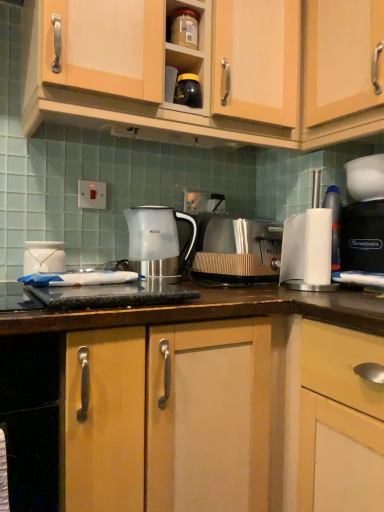
The image size is (384, 512). What do you see at coordinates (229, 318) in the screenshot? I see `brown laminate countertop at center` at bounding box center [229, 318].

Based on the photo, in order to face black plastic coffee machine at right, should I rotate leftwards or rightwards?

Turn right by 23.637 degrees to look at black plastic coffee machine at right.

Where is `wooden cabinet at upper center, which appears as the 1th cabinetry when viewed from the left`? The height and width of the screenshot is (512, 384). wooden cabinet at upper center, which appears as the 1th cabinetry when viewed from the left is located at coordinates (214, 71).

Where is `metallic silver toaster at center`? metallic silver toaster at center is located at coordinates (236, 249).

This screenshot has height=512, width=384. Identify the location of brown laminate countertop at center. (229, 318).

Does brown laminate countertop at center have a greater height compared to black glossy jar at upper center, which is the second appliance in bottom-to-top order?

Indeed, brown laminate countertop at center has a greater height compared to black glossy jar at upper center, which is the second appliance in bottom-to-top order.

From the image's perspective, is brown laminate countertop at center on black glossy jar at upper center, which is the second appliance in bottom-to-top order?

No.

Which is correct: brown laminate countertop at center is inside black glossy jar at upper center, the first appliance in the top-to-bottom sequence, or outside of it?

brown laminate countertop at center lies outside black glossy jar at upper center, the first appliance in the top-to-bottom sequence.

Is black plastic coffee machine at right facing away from white glossy jar at left, which is the first appliance in bottom-to-top order?

No, black plastic coffee machine at right's orientation is not away from white glossy jar at left, which is the first appliance in bottom-to-top order.

From the image's perspective, which one is positioned lower, black plastic coffee machine at right or white glossy jar at left, which is the first appliance in bottom-to-top order?

white glossy jar at left, which is the first appliance in bottom-to-top order.

Between point (361, 160) and point (31, 265), which one is positioned behind?

The point (361, 160) is farther.

Can you confirm if black plastic coffee machine at right is positioned to the right of white glossy jar at left, the 2th appliance positioned from the top?

Yes, black plastic coffee machine at right is to the right of white glossy jar at left, the 2th appliance positioned from the top.

Is metallic silver toaster at center far away from matte plastic container at upper center?

No, metallic silver toaster at center is not far from matte plastic container at upper center.

Is the position of metallic silver toaster at center more distant than that of matte plastic container at upper center?

Yes, metallic silver toaster at center is further from the viewer.

From a real-world perspective, is metallic silver toaster at center located higher than matte plastic container at upper center?

No, from a real-world perspective, metallic silver toaster at center is not on top of matte plastic container at upper center.

Is point (218, 224) less distant than point (190, 7)?

No.

Which is behind, brown laminate countertop at center or black plastic coffee machine at right?

black plastic coffee machine at right is further away from the camera.

Is brown laminate countertop at center aimed at black plastic coffee machine at right?

No, brown laminate countertop at center is not turned towards black plastic coffee machine at right.

Considering the sizes of brown laminate countertop at center and black plastic coffee machine at right in the image, is brown laminate countertop at center wider or thinner than black plastic coffee machine at right?

Clearly, brown laminate countertop at center has more width compared to black plastic coffee machine at right.

Between brown laminate countertop at center and black plastic coffee machine at right, which one has more height?

With more height is brown laminate countertop at center.

Is white paper towel at right at the back of white glossy jar at left, the 1th appliance positioned from the left?

No, white glossy jar at left, the 1th appliance positioned from the left, is not facing the opposite direction of white paper towel at right.

Can you see white glossy jar at left, the 2th appliance positioned from the top, touching white paper towel at right?

white glossy jar at left, the 2th appliance positioned from the top, and white paper towel at right are clearly separated.

Considering the sizes of objects white glossy jar at left, which is the first appliance in bottom-to-top order, and white paper towel at right in the image provided, who is wider, white glossy jar at left, which is the first appliance in bottom-to-top order, or white paper towel at right?

Wider between the two is white glossy jar at left, which is the first appliance in bottom-to-top order.

Is point (42, 263) closer or farther from the camera than point (332, 188)?

Clearly, point (42, 263) is closer to the camera than point (332, 188).

Is point (145, 208) closer or farther from the camera than point (330, 86)?

Point (145, 208).

Considering their positions, is translucent plastic kettle at center located in front of or behind wooden cabinet at upper center, acting as the 2th cabinetry starting from the right?

Visually, translucent plastic kettle at center is located behind wooden cabinet at upper center, acting as the 2th cabinetry starting from the right.

Between translucent plastic kettle at center and wooden cabinet at upper center, which appears as the 1th cabinetry when viewed from the left, which one has smaller size?

translucent plastic kettle at center.

Does translucent plastic kettle at center touch wooden cabinet at upper center, which appears as the 1th cabinetry when viewed from the left?

No, translucent plastic kettle at center is not making contact with wooden cabinet at upper center, which appears as the 1th cabinetry when viewed from the left.

Does wooden cabinet at upper center, acting as the 2th cabinetry starting from the right, touch white paper towel at right?

wooden cabinet at upper center, acting as the 2th cabinetry starting from the right, is not next to white paper towel at right, and they're not touching.

Is wooden cabinet at upper center, which appears as the 1th cabinetry when viewed from the left, facing towards white paper towel at right?

No, wooden cabinet at upper center, which appears as the 1th cabinetry when viewed from the left, is not facing towards white paper towel at right.

From a real-world perspective, which is physically above, wooden cabinet at upper center, acting as the 2th cabinetry starting from the right, or white paper towel at right?

wooden cabinet at upper center, acting as the 2th cabinetry starting from the right.

Consider the image. Does wooden cabinet at upper center, which appears as the 1th cabinetry when viewed from the left, have a greater height compared to white paper towel at right?

Correct, wooden cabinet at upper center, which appears as the 1th cabinetry when viewed from the left, is much taller as white paper towel at right.

This screenshot has width=384, height=512. What are the coordinates of `countertop located underneath the black glossy jar at upper center, which ranks as the second appliance in left-to-right order (from a real-world perspective)` in the screenshot? It's located at (229, 318).

Starting from the black plastic coffee machine at right, which appliance is the 2nd one to the left? Please provide its 2D coordinates.

[(44, 257)]

Looking at the image, which one is located further to white glossy jar at left, which is the first appliance in bottom-to-top order, brown laminate countertop at center or white paper towel at right?

Based on the image, white paper towel at right appears to be further to white glossy jar at left, which is the first appliance in bottom-to-top order.

Based on their spatial positions, is white glossy jar at left, the second appliance when ordered from right to left, or wooden cabinet at upper center, which appears as the 1th cabinetry when viewed from the left, further from black glossy jar at upper center, placed as the first appliance when sorted from right to left?

white glossy jar at left, the second appliance when ordered from right to left, lies further to black glossy jar at upper center, placed as the first appliance when sorted from right to left, than the other object.

From the image, which object appears to be farther from black plastic coffee machine at right, translucent plastic kettle at center or metallic silver toaster at center?

translucent plastic kettle at center lies further to black plastic coffee machine at right than the other object.

In the scene shown: Which object lies further to the anchor point wooden cabinet at upper center, acting as the 2th cabinetry starting from the right, brown laminate countertop at center or black plastic coffee machine at right?

brown laminate countertop at center is positioned further to the anchor wooden cabinet at upper center, acting as the 2th cabinetry starting from the right.

Looking at the image, which one is located closer to black plastic coffee machine at right, matte plastic container at upper center or translucent plastic kettle at center?

Based on the image, translucent plastic kettle at center appears to be nearer to black plastic coffee machine at right.

Considering their positions, is black plastic coffee machine at right positioned closer to black glossy jar at upper center, which ranks as the second appliance in left-to-right order, than translucent plastic kettle at center?

Based on the image, translucent plastic kettle at center appears to be nearer to black glossy jar at upper center, which ranks as the second appliance in left-to-right order.

Based on the photo, which object lies further to the anchor point matte plastic container at upper center, light wood cabinet at upper right, the 1th cabinetry when ordered from right to left, or white paper towel at right?

Among the two, white paper towel at right is located further to matte plastic container at upper center.

Considering their positions, is black glossy jar at upper center, which ranks as the second appliance in left-to-right order, positioned further to metallic silver toaster at center than light wood cabinet at upper right, placed as the 2th cabinetry when sorted from left to right?

light wood cabinet at upper right, placed as the 2th cabinetry when sorted from left to right, lies further to metallic silver toaster at center than the other object.

Find the location of a particular element. appliance between matte plastic container at upper center and white glossy jar at left, which is the first appliance in bottom-to-top order, from top to bottom is located at coordinates (188, 90).

At what (x,y) coordinates should I click in order to perform the action: click on appliance situated between translucent plastic kettle at center and white paper towel at right from left to right. Please return your answer as a coordinate pair (x, y). This screenshot has height=512, width=384. Looking at the image, I should click on click(x=188, y=90).

At what (x,y) coordinates should I click in order to perform the action: click on shelf between wooden cabinet at upper center, which appears as the 1th cabinetry when viewed from the left, and translucent plastic kettle at center from top to bottom. Please return your answer as a coordinate pair (x, y). This screenshot has height=512, width=384. Looking at the image, I should click on (196, 12).

The image size is (384, 512). I want to click on shelf between wooden cabinet at upper center, acting as the 2th cabinetry starting from the right, and brown laminate countertop at center, in the vertical direction, so click(196, 12).